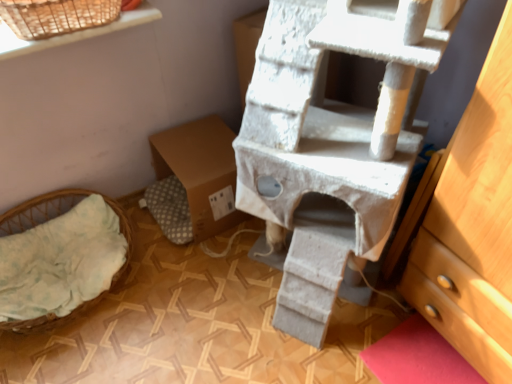
Question: Can you confirm if light green fabric basket at lower left is positioned to the left of white textured cat tree at center?

Choices:
 (A) yes
 (B) no

Answer: (A)

Question: From the image's perspective, is light green fabric basket at lower left below white textured cat tree at center?

Choices:
 (A) no
 (B) yes

Answer: (B)

Question: Is light green fabric basket at lower left wider than white textured cat tree at center?

Choices:
 (A) no
 (B) yes

Answer: (A)

Question: Is light green fabric basket at lower left next to white textured cat tree at center and touching it?

Choices:
 (A) no
 (B) yes

Answer: (A)

Question: Is light green fabric basket at lower left positioned before white textured cat tree at center?

Choices:
 (A) yes
 (B) no

Answer: (B)

Question: Can you confirm if light green fabric basket at lower left is shorter than white textured cat tree at center?

Choices:
 (A) no
 (B) yes

Answer: (B)

Question: From a real-world perspective, is white textured cat tree at center over brown cardboard box at center?

Choices:
 (A) yes
 (B) no

Answer: (A)

Question: Does white textured cat tree at center have a lesser height compared to brown cardboard box at center?

Choices:
 (A) yes
 (B) no

Answer: (B)

Question: Can you confirm if white textured cat tree at center is positioned to the left of brown cardboard box at center?

Choices:
 (A) yes
 (B) no

Answer: (B)

Question: Does white textured cat tree at center have a larger size compared to brown cardboard box at center?

Choices:
 (A) no
 (B) yes

Answer: (B)

Question: Considering the relative positions of white textured cat tree at center and brown cardboard box at center in the image provided, is white textured cat tree at center to the right of brown cardboard box at center from the viewer's perspective?

Choices:
 (A) yes
 (B) no

Answer: (A)

Question: From the image's perspective, is white textured cat tree at center over brown cardboard box at center?

Choices:
 (A) yes
 (B) no

Answer: (A)

Question: Is light green fabric basket at lower left taller than brown cardboard box at center?

Choices:
 (A) no
 (B) yes

Answer: (A)